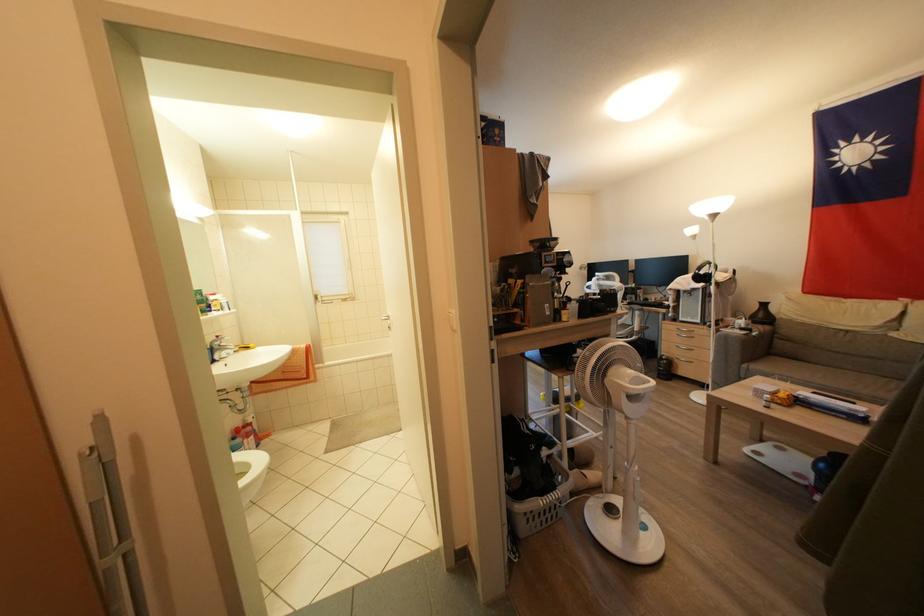
What do you see at coordinates (812, 375) in the screenshot?
I see `the sofa sitting surface` at bounding box center [812, 375].